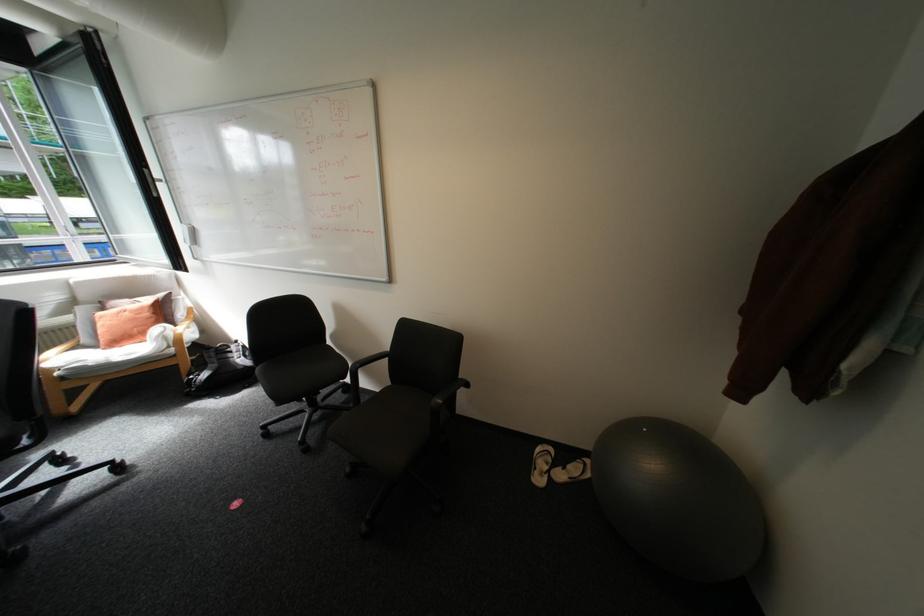
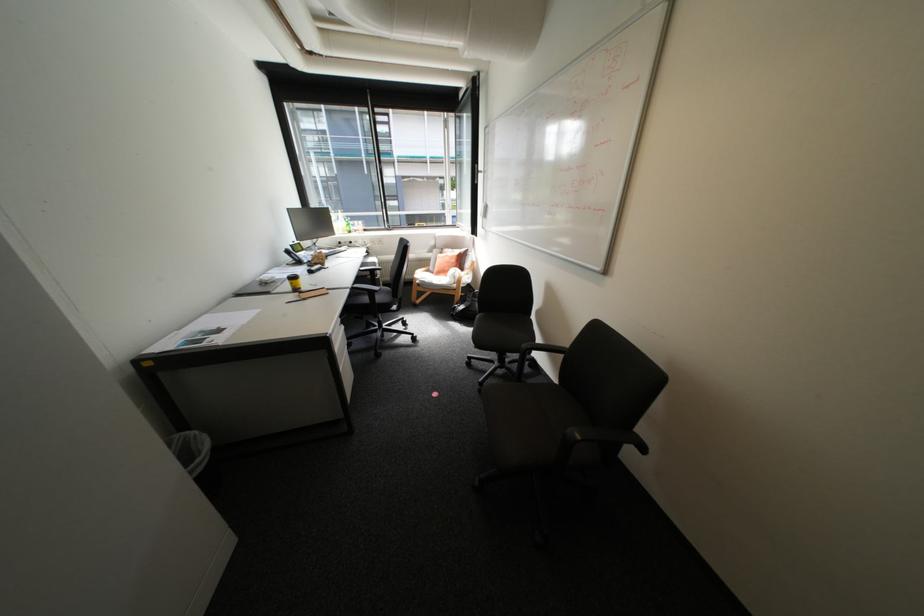
Where in the second image is the point corresponding to point (234, 398) from the first image?

(473, 326)